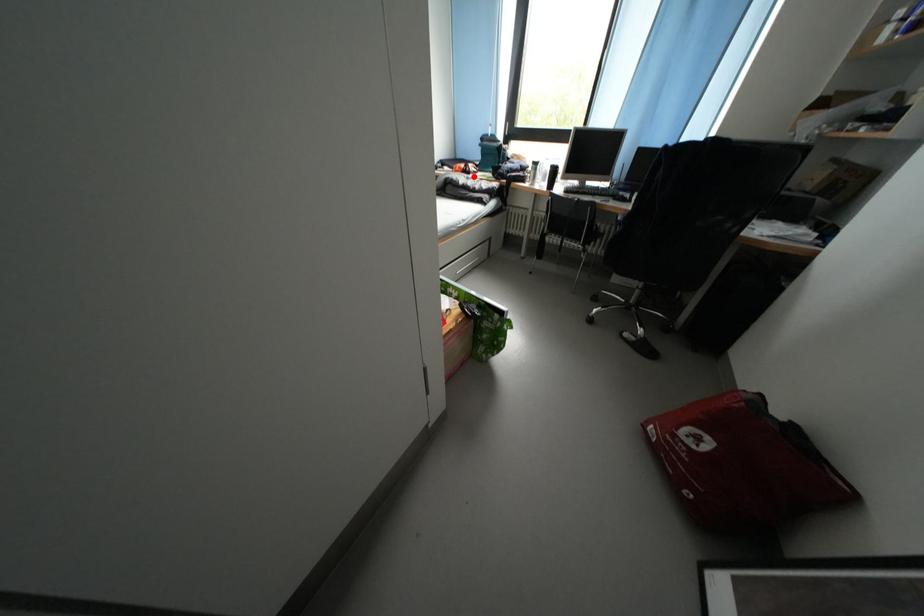
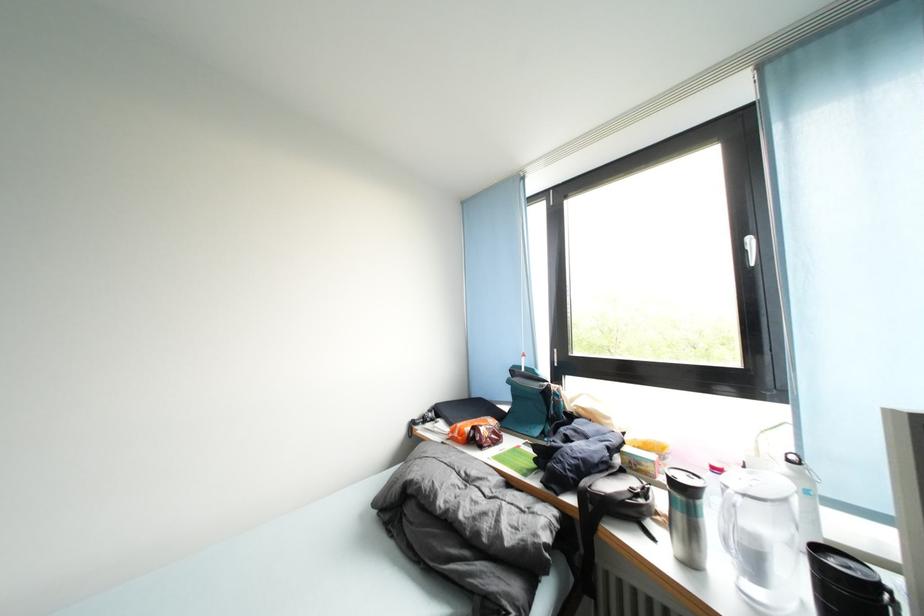
The point at the highlighted location is marked in the first image. Where is the corresponding point in the second image?

(482, 446)